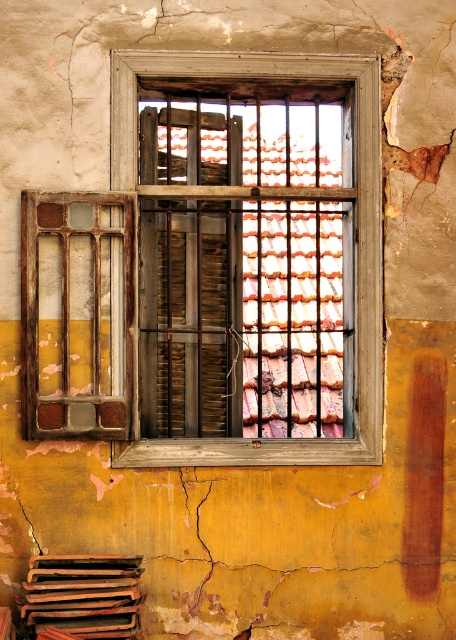
Is point (146, 465) farther from camera compared to point (72, 200)?

That is True.

Between wooden frame at center and rusty metal shutter at left, which one has less height?

rusty metal shutter at left is shorter.

Does point (219, 449) lie in front of point (108, 397)?

No, (219, 449) is further to viewer.

Find the location of a particular element. wooden frame at center is located at coordinates [355, 246].